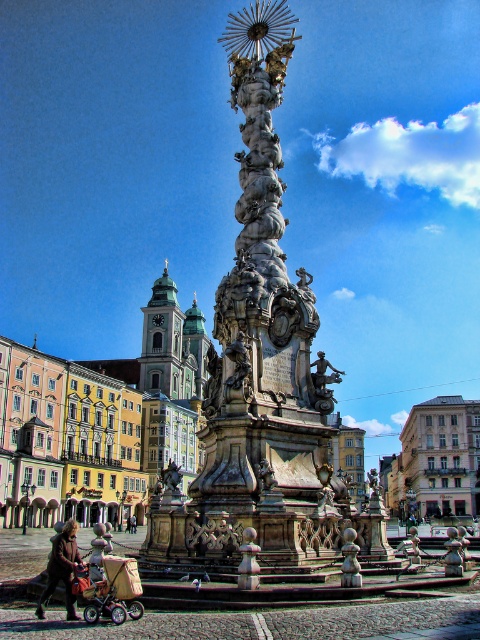
Looking at this image, you are a tourist standing in the city square and see the brown leather coat at lower left and the light brown leather jacket at lower center. Which item is taller?

The brown leather coat at lower left is much taller than the light brown leather jacket at lower center according to the description.